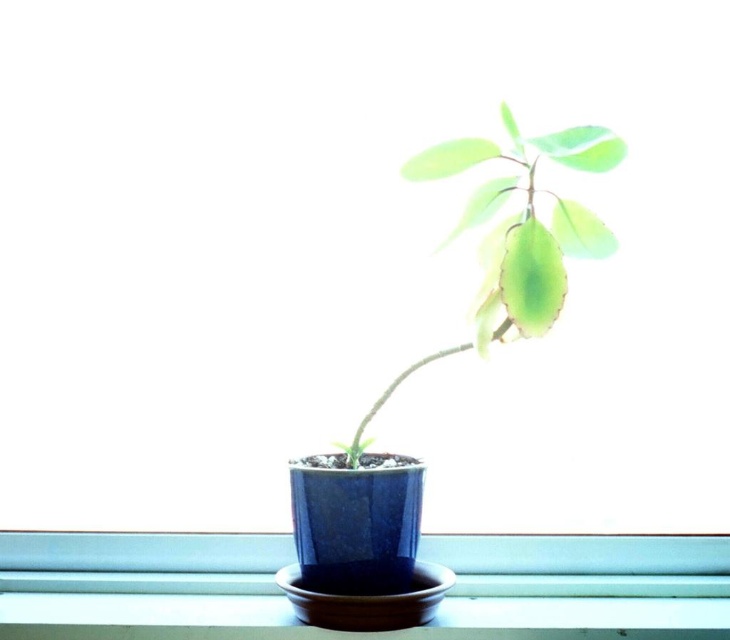
Question: Does green matte leafy plant at center lie behind green matte leaf at upper center?

Choices:
 (A) yes
 (B) no

Answer: (B)

Question: Is green matte leafy plant at center positioned at the back of green matte leaf at upper center?

Choices:
 (A) yes
 (B) no

Answer: (B)

Question: Is the position of green matte leafy plant at center less distant than that of green matte leaf at upper center?

Choices:
 (A) no
 (B) yes

Answer: (B)